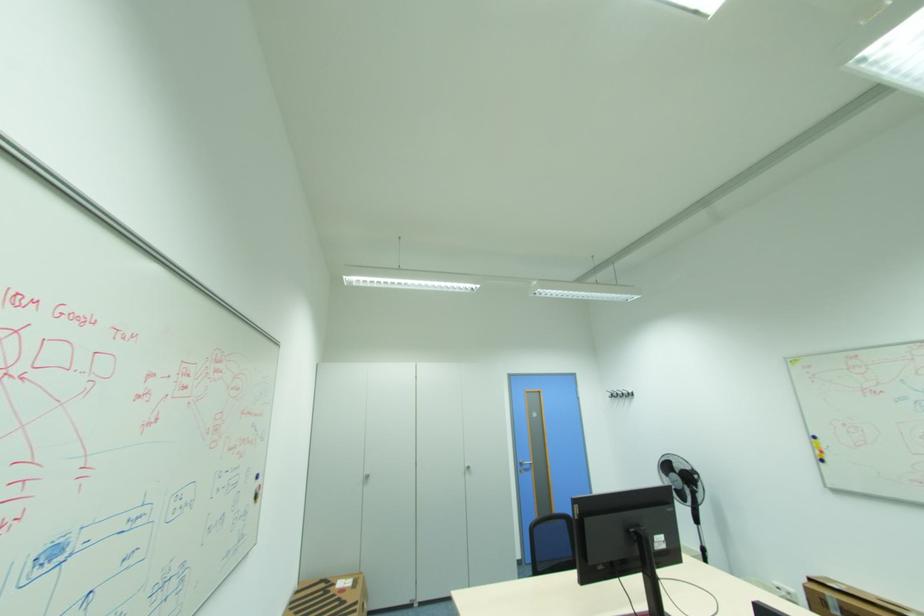
The width and height of the screenshot is (924, 616). What do you see at coordinates (523, 467) in the screenshot? I see `the silver door handle` at bounding box center [523, 467].